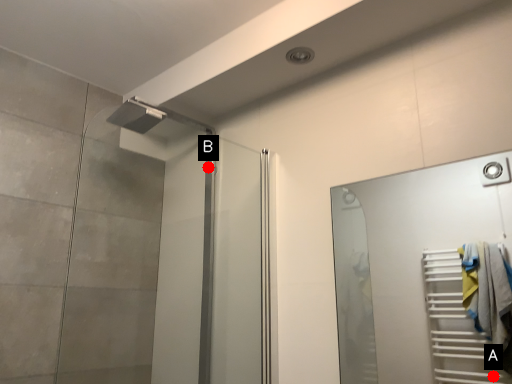
Question: Two points are circled on the image, labeled by A and B beside each circle. Which point appears closest to the camera in this image?

Choices:
 (A) A is closer
 (B) B is closer

Answer: (B)